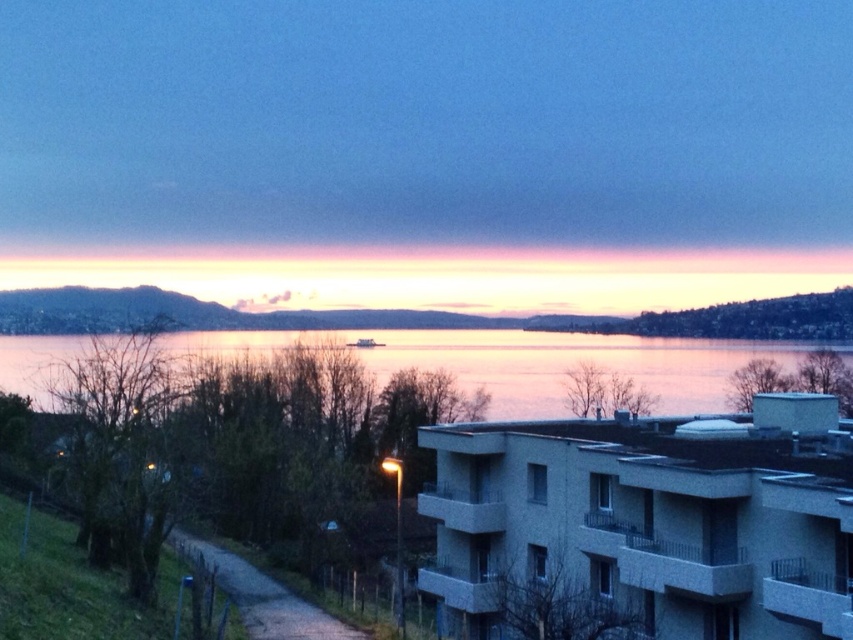
Can you confirm if silvery reflective water at center is smaller than dirt/gravel path at lower left?

Actually, silvery reflective water at center might be larger than dirt/gravel path at lower left.

Does silvery reflective water at center have a larger size compared to dirt/gravel path at lower left?

Indeed, silvery reflective water at center has a larger size compared to dirt/gravel path at lower left.

Is point (207, 352) in front of point (253, 586)?

That is False.

The width and height of the screenshot is (853, 640). I want to click on silvery reflective water at center, so click(x=526, y=362).